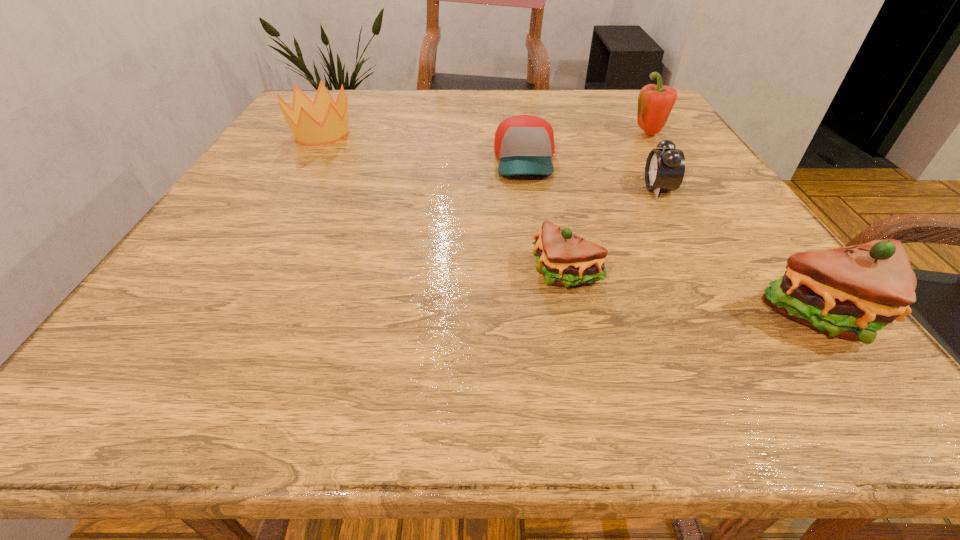
Where is `free space located 0.160m on the front side of the alarm clock`? Image resolution: width=960 pixels, height=540 pixels. free space located 0.160m on the front side of the alarm clock is located at coordinates (564, 188).

Image resolution: width=960 pixels, height=540 pixels. Find the location of `vacant position located on the front side of the alarm clock`. vacant position located on the front side of the alarm clock is located at coordinates 554,188.

Where is `vacant region located on the front side of the alarm clock`? The height and width of the screenshot is (540, 960). vacant region located on the front side of the alarm clock is located at coordinates (523, 188).

Locate an element on the screen. This screenshot has height=540, width=960. vacant space located on the front of the leftmost object is located at coordinates (246, 264).

The image size is (960, 540). I want to click on object at the far edge, so pos(303,119).

Where is `object situated at the left edge`? object situated at the left edge is located at coordinates (303, 119).

Locate an element on the screen. This screenshot has width=960, height=540. sandwich present at the right edge is located at coordinates (850, 292).

The height and width of the screenshot is (540, 960). Find the location of `pepper located at the right edge`. pepper located at the right edge is located at coordinates (655, 102).

At what (x,y) coordinates should I click in order to perform the action: click on alarm clock that is at the right edge. Please return your answer as a coordinate pair (x, y). Looking at the image, I should click on (664, 171).

Image resolution: width=960 pixels, height=540 pixels. In order to click on object located in the far left corner section of the desktop in this screenshot , I will do `click(303, 119)`.